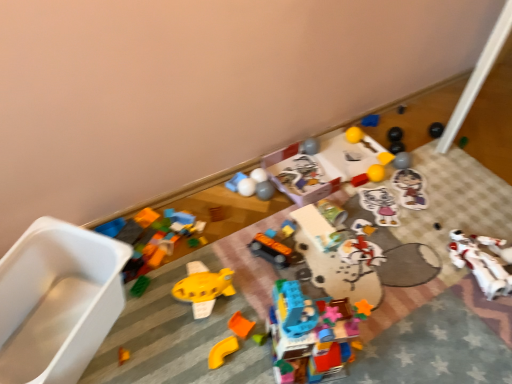
Locate an element on the screen. The height and width of the screenshot is (384, 512). free space between yellow rubber ball at upper center, acting as the fifteenth toy starting from the left, and orange matte block at center, which ranks as the fifth toy in left-to-right order is located at coordinates (325, 229).